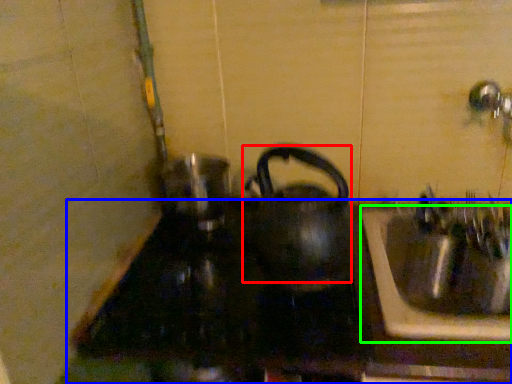
Question: Which object is the farthest from kettle (highlighted by a red box)? Choose among these: counter top (highlighted by a blue box) or sink (highlighted by a green box).

Choices:
 (A) counter top
 (B) sink

Answer: (B)